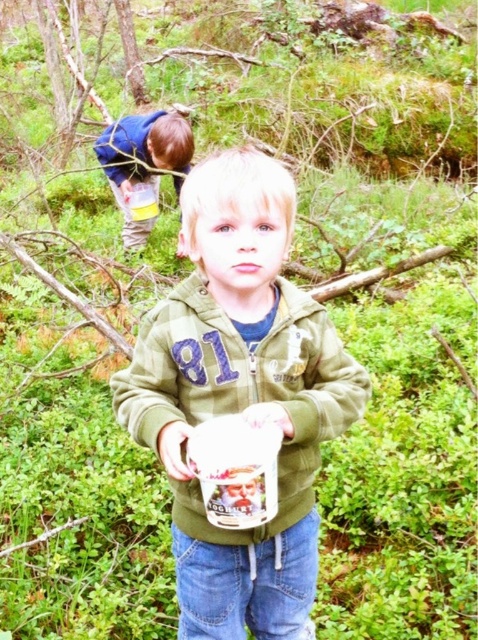
Question: Can you confirm if green matte jacket at center is wider than blue denim pants at upper left?

Choices:
 (A) yes
 (B) no

Answer: (B)

Question: Which point is closer to the camera?

Choices:
 (A) (317, 346)
 (B) (123, 214)

Answer: (A)

Question: Does green matte jacket at center appear on the right side of blue denim pants at upper left?

Choices:
 (A) no
 (B) yes

Answer: (B)

Question: Among these objects, which one is farthest from the camera?

Choices:
 (A) green matte jacket at center
 (B) blue denim pants at upper left

Answer: (B)

Question: Does green matte jacket at center have a larger size compared to blue denim pants at upper left?

Choices:
 (A) no
 (B) yes

Answer: (A)

Question: Which of the following is the farthest from the observer?

Choices:
 (A) blue denim pants at upper left
 (B) green matte jacket at center

Answer: (A)